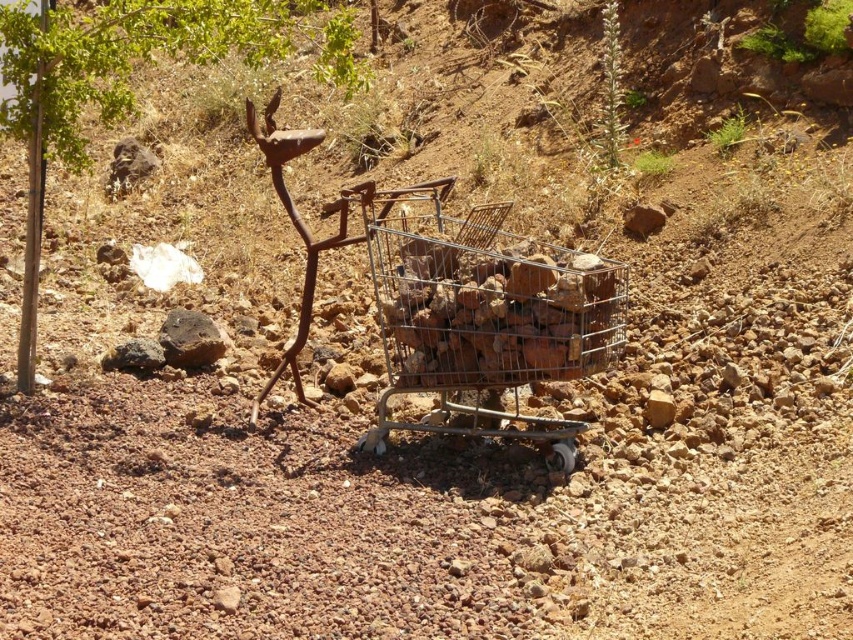
Question: Based on their relative distances, which object is nearer to the green leafy tree at upper left?

Choices:
 (A) rusty metal shopping cart at center
 (B) metallic wire crate at center

Answer: (A)

Question: Which point is farther from the camera taking this photo?

Choices:
 (A) (258, 145)
 (B) (422, 364)
 (C) (165, 28)

Answer: (A)

Question: Is rusty metal shopping cart at center to the right of green leafy tree at upper left from the viewer's perspective?

Choices:
 (A) no
 (B) yes

Answer: (B)

Question: Which point is closer to the camera taking this photo?

Choices:
 (A) (444, 256)
 (B) (368, 182)
 (C) (24, 12)

Answer: (A)

Question: Does metallic wire crate at center have a lesser width compared to green leafy tree at upper left?

Choices:
 (A) no
 (B) yes

Answer: (B)

Question: Is rusty metal shopping cart at center to the right of green leafy tree at upper left from the viewer's perspective?

Choices:
 (A) yes
 (B) no

Answer: (A)